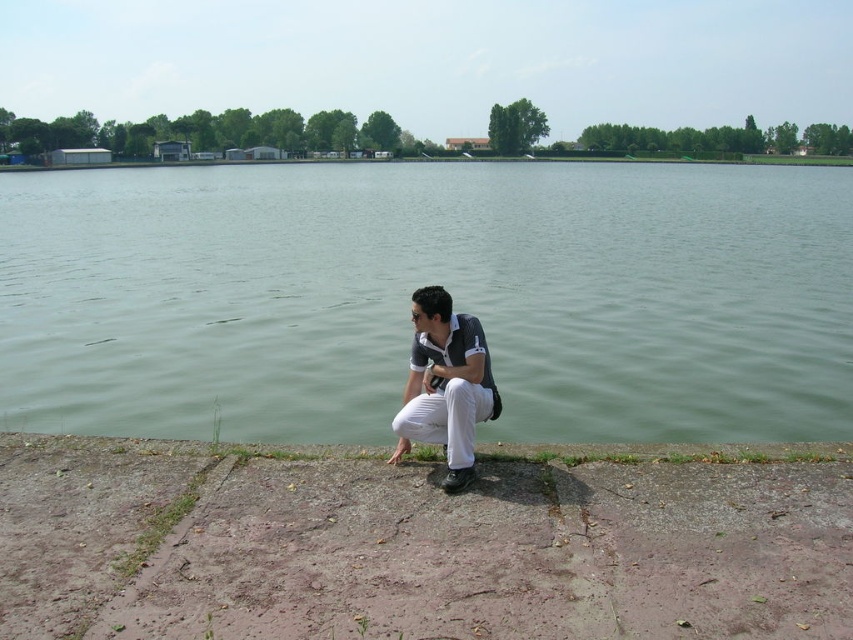
From the picture: You are a photographer standing on the lakeside. You have to decide whether to place your subject in the green water at lower center or the white cotton pants at lower center to ensure it fits within the frame. Which location has a larger width according to the scene description?

The green water at lower center might be wider than white cotton pants at lower center, so placing the subject in the green water at lower center would likely provide enough space for the subject to fit within the frame.

You are standing at the lakeside and see the white cotton pants at lower center and the gray concrete curb at lower center. Which object is nearer to you?

The white cotton pants at lower center is closer to the viewer than the gray concrete curb at lower center.